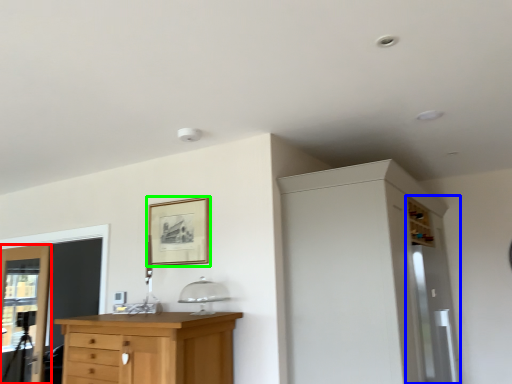
Question: Estimate the real-world distances between objects in this image. Which object is farther from door (highlighted by a red box), screen door (highlighted by a blue box) or picture frame (highlighted by a green box)?

Choices:
 (A) screen door
 (B) picture frame

Answer: (A)